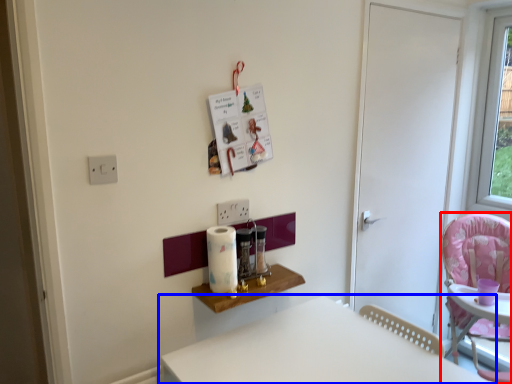
Question: Which object is closer to the camera taking this photo, chair (highlighted by a red box) or table (highlighted by a blue box)?

Choices:
 (A) chair
 (B) table

Answer: (B)